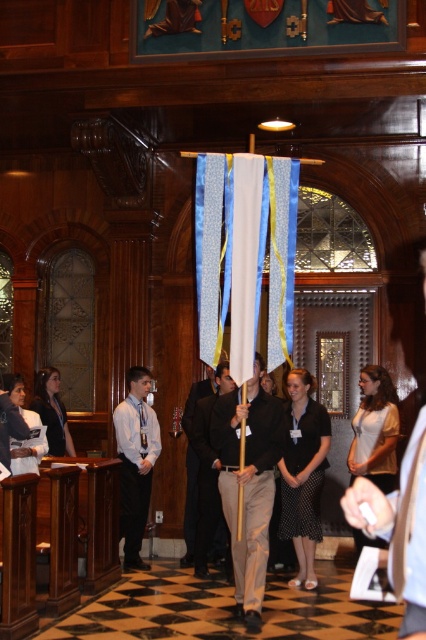
Is point (238, 424) positioned before point (408, 504)?

No, (238, 424) is behind (408, 504).

Which is more to the left, matte black shirt at center or white fabric at center?

matte black shirt at center

Is point (235, 563) positioned after point (420, 600)?

Yes, it is.

Where is `matte black shirt at center`? matte black shirt at center is located at coordinates (247, 483).

How far apart are white fabric at center and black fabric at center?

They are 6.55 meters apart.

Between white fabric at center and black fabric at center, which one appears on the right side from the viewer's perspective?

Positioned to the right is white fabric at center.

Between point (425, 547) and point (206, 484), which one is positioned in front?

Point (425, 547) is more forward.

Locate an element on the screen. This screenshot has height=640, width=426. white fabric at center is located at coordinates (400, 529).

Is matte black shirt at center below black fabric at center?

No, matte black shirt at center is not below black fabric at center.

Who is more distant from viewer, (244, 600) or (204, 566)?

The point (204, 566) is behind.

Image resolution: width=426 pixels, height=640 pixels. Find the location of `matte black shirt at center`. matte black shirt at center is located at coordinates 247,483.